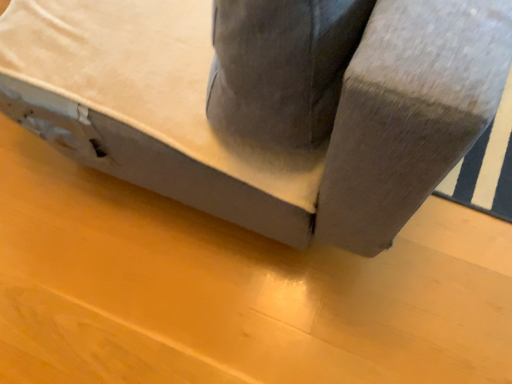
Identify the location of free space in front of suede gray couch at center. This screenshot has height=384, width=512. (283, 299).